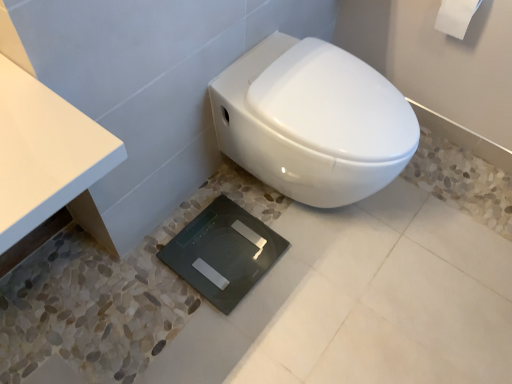
Identify the location of vacant space to the left of black glass scale at center. (137, 268).